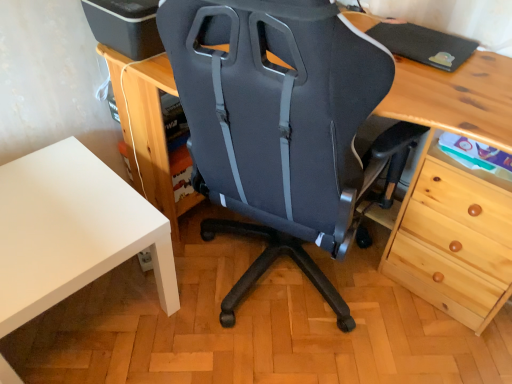
Question: Is white matte table at lower left at the right side of matte black chair at center?

Choices:
 (A) no
 (B) yes

Answer: (A)

Question: Is matte black chair at center at the back of white matte table at lower left?

Choices:
 (A) no
 (B) yes

Answer: (A)

Question: From a real-world perspective, is white matte table at lower left positioned over matte black chair at center based on gravity?

Choices:
 (A) yes
 (B) no

Answer: (B)

Question: Is white matte table at lower left completely or partially outside of matte black chair at center?

Choices:
 (A) no
 (B) yes

Answer: (B)

Question: From the image's perspective, is white matte table at lower left located beneath matte black chair at center?

Choices:
 (A) no
 (B) yes

Answer: (B)

Question: Does white matte table at lower left have a larger size compared to matte black chair at center?

Choices:
 (A) no
 (B) yes

Answer: (A)

Question: Is matte black chair at center not near white matte table at lower left?

Choices:
 (A) yes
 (B) no

Answer: (B)

Question: From the image's perspective, is matte black chair at center located beneath white matte table at lower left?

Choices:
 (A) yes
 (B) no

Answer: (B)

Question: Is matte black chair at center positioned behind white matte table at lower left?

Choices:
 (A) no
 (B) yes

Answer: (A)

Question: Is matte black chair at center taller than white matte table at lower left?

Choices:
 (A) no
 (B) yes

Answer: (B)

Question: Is matte black chair at center at the right side of white matte table at lower left?

Choices:
 (A) yes
 (B) no

Answer: (A)

Question: Is matte black chair at center not inside white matte table at lower left?

Choices:
 (A) no
 (B) yes

Answer: (B)

Question: In the image, is white matte table at lower left on the left side or the right side of matte black chair at center?

Choices:
 (A) right
 (B) left

Answer: (B)